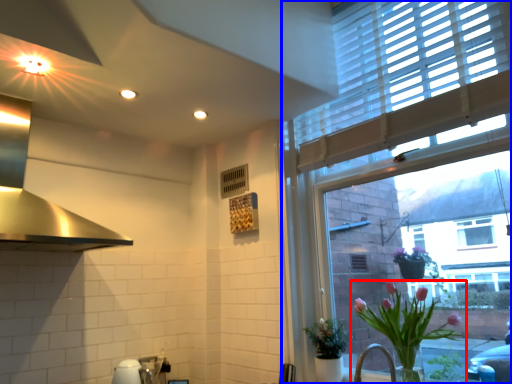
Question: Which object is further to the camera taking this photo, houseplant (highlighted by a red box) or window (highlighted by a blue box)?

Choices:
 (A) houseplant
 (B) window

Answer: (A)